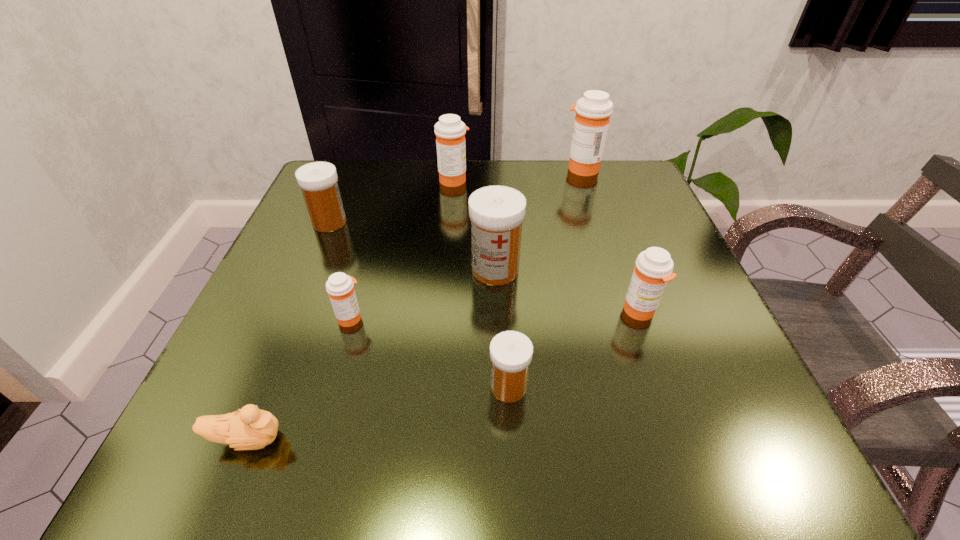
This screenshot has height=540, width=960. In order to click on the second medicine from left to right in this screenshot , I will do `click(340, 287)`.

Where is `the smallest white medicine`? Image resolution: width=960 pixels, height=540 pixels. the smallest white medicine is located at coordinates (511, 352).

Identify the location of the nearest white medicine. This screenshot has height=540, width=960. (511, 352).

At what (x,y) coordinates should I click in order to perform the action: click on the shortest object. Please return your answer as a coordinate pair (x, y). This screenshot has height=540, width=960. Looking at the image, I should click on (251, 428).

Where is `the nearest object`? Image resolution: width=960 pixels, height=540 pixels. the nearest object is located at coordinates (251, 428).

Image resolution: width=960 pixels, height=540 pixels. In order to click on vacant region located 0.340m on the left of the biggest orange medicine in this screenshot , I will do `click(423, 168)`.

Find the location of `vacant space located on the right of the third medicine from left to right`. vacant space located on the right of the third medicine from left to right is located at coordinates (602, 179).

Identify the location of vacant space situated on the left of the fourth farthest object. The image size is (960, 540). (382, 270).

Locate an element on the screen. The height and width of the screenshot is (540, 960). vacant space located 0.130m on the front of the leftmost medicine is located at coordinates (306, 278).

I want to click on vacant point located on the left of the third biggest orange medicine, so click(x=455, y=311).